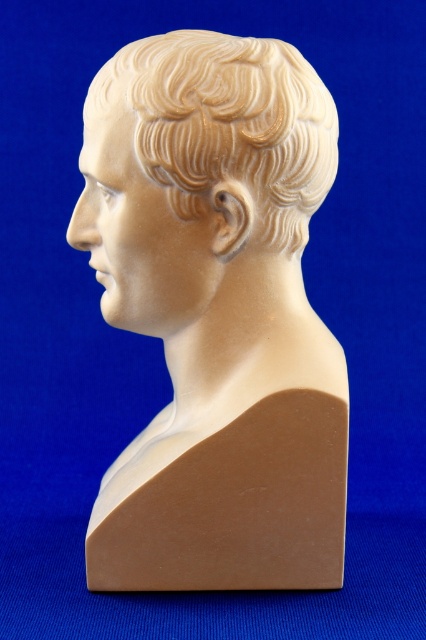
You are an art conservator examining the classical bust sculpture. You need to determine if the matte white bust at center can be placed in a display case that is 1.2 meters wide. Given that the sandy beige wax hair at center is 0.8 meters wide, can the bust fit into the case?

The matte white bust at center is wider than the sandy beige wax hair at center, which is 0.8 meters wide. Since the display case is 1.2 meters wide, the bust may fit if its width is less than or equal to 1.2 meters. However, without knowing the exact width of the bust, we cannot confirm for certain.

You are an art conservator examining a classical bust sculpture. You notice the matte white bust at center and the sandy beige wax hair at center. Based on their sizes, which part of the sculpture might require more support to prevent damage?

The matte white bust at center is much taller than the sandy beige wax hair at center, so the taller matte white bust at center might require more support to prevent damage due to its greater height and potential instability.